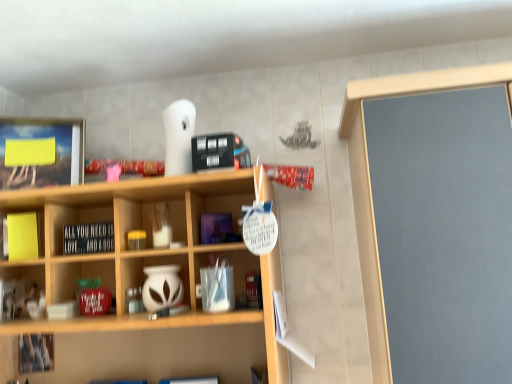
Question: Does yellow matte sticky notes at left, which is counted as the 1th cabinet, starting from the top, have a smaller size compared to white matte vase at center, which is the second cabinet in left-to-right order?

Choices:
 (A) no
 (B) yes

Answer: (B)

Question: Considering the relative positions of yellow matte sticky notes at left, which is counted as the 1th cabinet, starting from the top, and white matte vase at center, which is the second cabinet in top-to-bottom order, in the image provided, is yellow matte sticky notes at left, which is counted as the 1th cabinet, starting from the top, to the right of white matte vase at center, which is the second cabinet in top-to-bottom order, from the viewer's perspective?

Choices:
 (A) yes
 (B) no

Answer: (B)

Question: Is the position of yellow matte sticky notes at left, which is counted as the 1th cabinet, starting from the top, more distant than that of white matte vase at center, which is the second cabinet in left-to-right order?

Choices:
 (A) no
 (B) yes

Answer: (B)

Question: Could you tell me if yellow matte sticky notes at left, the 1th cabinet from the left, is turned towards white matte vase at center, which is the 1th cabinet in bottom-to-top order?

Choices:
 (A) no
 (B) yes

Answer: (A)

Question: From the image's perspective, is yellow matte sticky notes at left, which is counted as the 1th cabinet, starting from the top, above white matte vase at center, which is the 1th cabinet in right-to-left order?

Choices:
 (A) no
 (B) yes

Answer: (B)

Question: Considering the relative sizes of yellow matte sticky notes at left, the 1th cabinet from the left, and white matte vase at center, which is the 1th cabinet in right-to-left order, in the image provided, is yellow matte sticky notes at left, the 1th cabinet from the left, shorter than white matte vase at center, which is the 1th cabinet in right-to-left order,?

Choices:
 (A) yes
 (B) no

Answer: (B)

Question: Does yellow matte sticky notes at left, the 1th cabinet from the left, have a smaller size compared to black matte signboard at center?

Choices:
 (A) yes
 (B) no

Answer: (A)

Question: Considering the relative sizes of yellow matte sticky notes at left, the second cabinet positioned from the bottom, and black matte signboard at center in the image provided, is yellow matte sticky notes at left, the second cabinet positioned from the bottom, wider than black matte signboard at center?

Choices:
 (A) no
 (B) yes

Answer: (A)

Question: Can you confirm if yellow matte sticky notes at left, the 1th cabinet from the left, is positioned to the left of black matte signboard at center?

Choices:
 (A) no
 (B) yes

Answer: (B)

Question: From the image's perspective, is yellow matte sticky notes at left, which is counted as the 1th cabinet, starting from the top, under black matte signboard at center?

Choices:
 (A) yes
 (B) no

Answer: (B)

Question: Does yellow matte sticky notes at left, which is counted as the 1th cabinet, starting from the top, lie in front of black matte signboard at center?

Choices:
 (A) no
 (B) yes

Answer: (A)

Question: From the image's perspective, is yellow matte sticky notes at left, the second cabinet positioned from the bottom, on top of black matte signboard at center?

Choices:
 (A) yes
 (B) no

Answer: (A)

Question: Considering the relative sizes of black matte signboard at center and yellow matte sticky notes at left, the 1th cabinet from the left, in the image provided, is black matte signboard at center thinner than yellow matte sticky notes at left, the 1th cabinet from the left,?

Choices:
 (A) no
 (B) yes

Answer: (A)